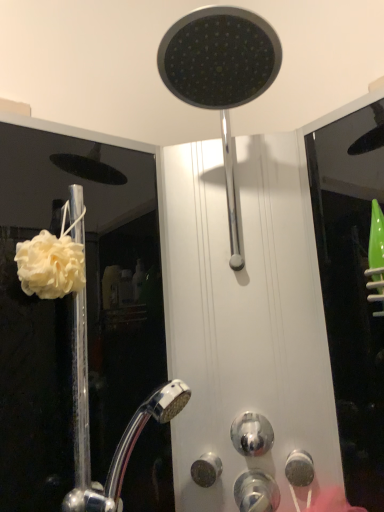
Question: Does white fluffy sponge at left have a lesser width compared to satin nickel knob at lower center, arranged as the 3th knob when viewed from the right?

Choices:
 (A) yes
 (B) no

Answer: (B)

Question: Is white fluffy sponge at left next to satin nickel knob at lower center, arranged as the 3th knob when viewed from the right?

Choices:
 (A) no
 (B) yes

Answer: (A)

Question: Is the depth of white fluffy sponge at left greater than that of satin nickel knob at lower center, arranged as the 3th knob when viewed from the right?

Choices:
 (A) yes
 (B) no

Answer: (B)

Question: From a real-world perspective, does white fluffy sponge at left stand above satin nickel knob at lower center, marked as the first knob in a left-to-right arrangement?

Choices:
 (A) yes
 (B) no

Answer: (A)

Question: Considering the relative sizes of white fluffy sponge at left and satin nickel knob at lower center, marked as the first knob in a left-to-right arrangement, in the image provided, is white fluffy sponge at left wider than satin nickel knob at lower center, marked as the first knob in a left-to-right arrangement,?

Choices:
 (A) no
 (B) yes

Answer: (B)

Question: From the image's perspective, relative to white matte shower curtain at left, is shiny metallic knob at center, the 2th knob when ordered from left to right, above or below?

Choices:
 (A) below
 (B) above

Answer: (A)

Question: Looking at their shapes, would you say shiny metallic knob at center, which is the second knob from right to left, is wider or thinner than white matte shower curtain at left?

Choices:
 (A) thin
 (B) wide

Answer: (A)

Question: In terms of height, does shiny metallic knob at center, which is the second knob from right to left, look taller or shorter compared to white matte shower curtain at left?

Choices:
 (A) tall
 (B) short

Answer: (B)

Question: From a real-world perspective, is shiny metallic knob at center, the 2th knob when ordered from left to right, positioned above or below white matte shower curtain at left?

Choices:
 (A) below
 (B) above

Answer: (A)

Question: From the image's perspective, is satin nickel knob at lower right, the first knob when ordered from right to left, located above or below white fluffy sponge at left?

Choices:
 (A) above
 (B) below

Answer: (B)

Question: From a real-world perspective, relative to white fluffy sponge at left, is satin nickel knob at lower right, the third knob when ordered from left to right, vertically above or below?

Choices:
 (A) below
 (B) above

Answer: (A)

Question: In the image, is satin nickel knob at lower right, the third knob when ordered from left to right, positioned in front of or behind white fluffy sponge at left?

Choices:
 (A) behind
 (B) front

Answer: (A)

Question: Is satin nickel knob at lower right, the first knob when ordered from right to left, spatially inside white fluffy sponge at left, or outside of it?

Choices:
 (A) outside
 (B) inside

Answer: (A)

Question: From a real-world perspective, is satin nickel knob at lower center, marked as the first knob in a left-to-right arrangement, physically located above or below shiny metallic knob at center, the 2th knob when ordered from left to right?

Choices:
 (A) above
 (B) below

Answer: (B)

Question: In terms of width, does satin nickel knob at lower center, marked as the first knob in a left-to-right arrangement, look wider or thinner when compared to shiny metallic knob at center, which is the second knob from right to left?

Choices:
 (A) thin
 (B) wide

Answer: (A)